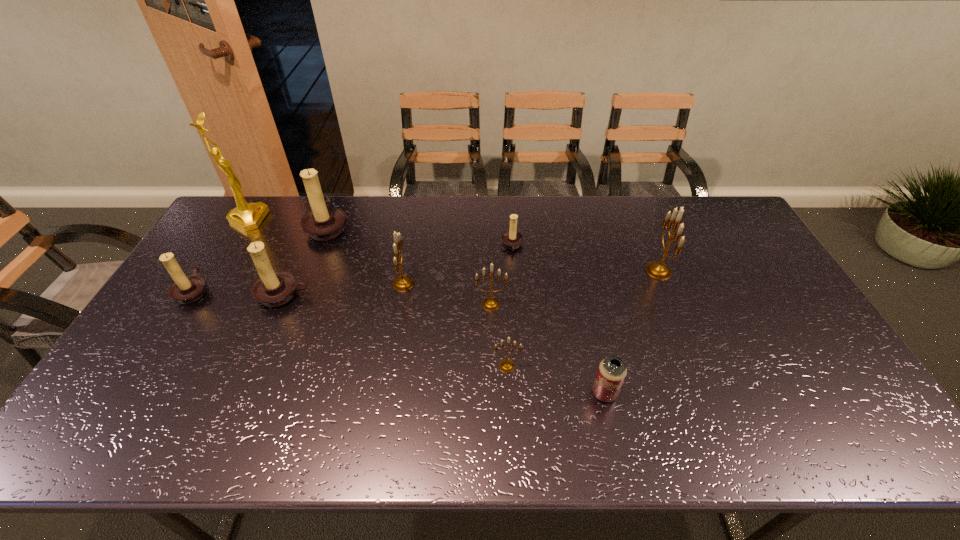
This screenshot has width=960, height=540. What are the coordinates of `golden award` in the screenshot? It's located at (247, 216).

What are the coordinates of `the tallest object` in the screenshot? It's located at (247, 216).

Image resolution: width=960 pixels, height=540 pixels. Identify the location of the biggest brown candle holder. (324, 222).

The image size is (960, 540). I want to click on the rightmost object, so click(657, 270).

This screenshot has height=540, width=960. Identify the location of the biggest gold candelabrum. (657, 270).

This screenshot has width=960, height=540. I want to click on the fourth candelabrum from left to right, so click(x=402, y=283).

What are the coordinates of `the second biggest gold candelabrum` in the screenshot? It's located at (402, 283).

The image size is (960, 540). In order to click on the second biggest brown candle holder in this screenshot , I will do `click(273, 289)`.

You are a GUI agent. You are given a task and a screenshot of the screen. Output one action in this format:
    pyautogui.click(x=<x>, y=<y>)
    Task: Click on the third biggest gold candelabrum
    This screenshot has height=540, width=960.
    Given the screenshot: What is the action you would take?
    pyautogui.click(x=490, y=303)

Where is `the leftmost candelabrum`? This screenshot has width=960, height=540. the leftmost candelabrum is located at coordinates (186, 290).